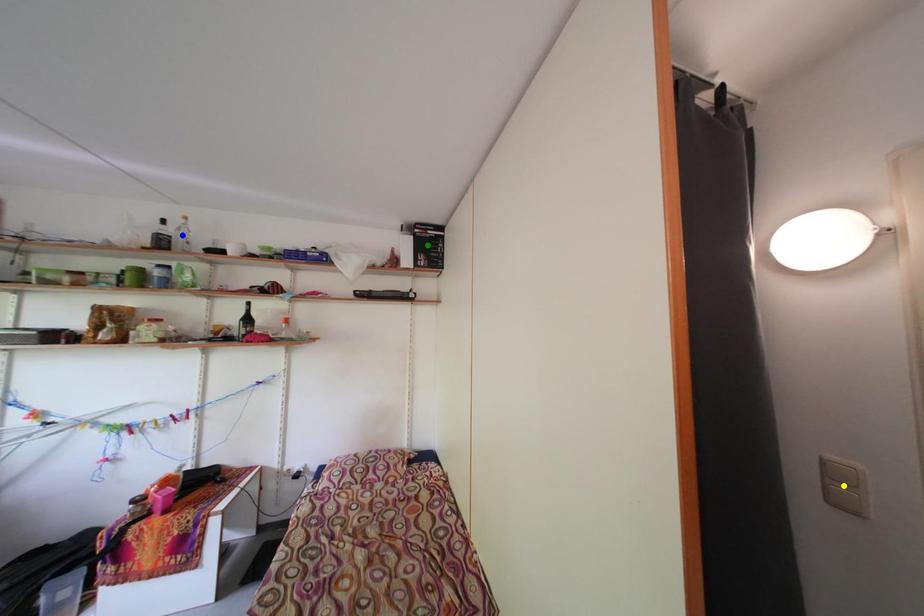
Order these from nearest to farthest:
A) yellow point
B) blue point
C) green point

1. green point
2. blue point
3. yellow point